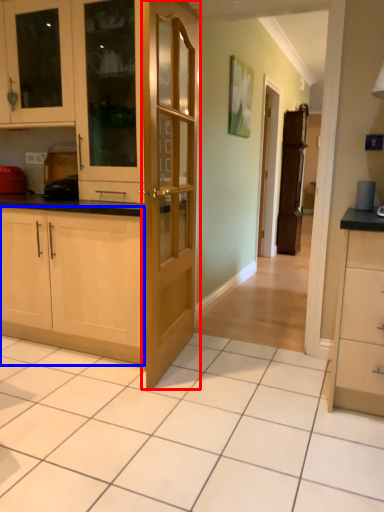
Question: Which object appears farthest to the camera in this image, door (highlighted by a red box) or cabinetry (highlighted by a blue box)?

Choices:
 (A) door
 (B) cabinetry

Answer: (B)